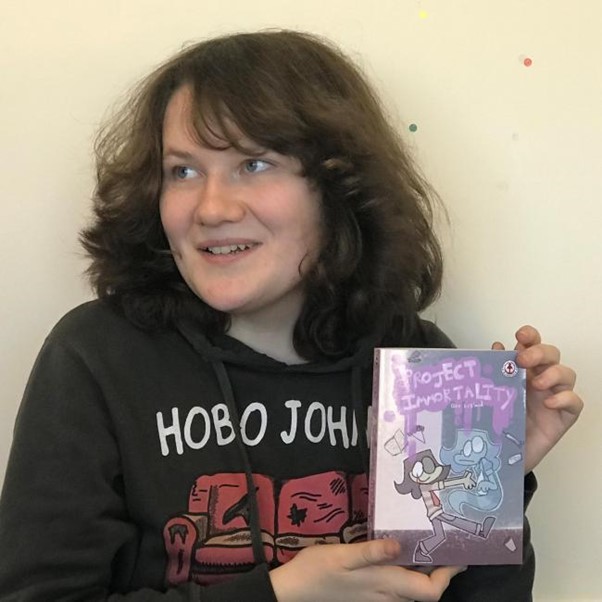
Where is `book`? book is located at coordinates (398, 486).